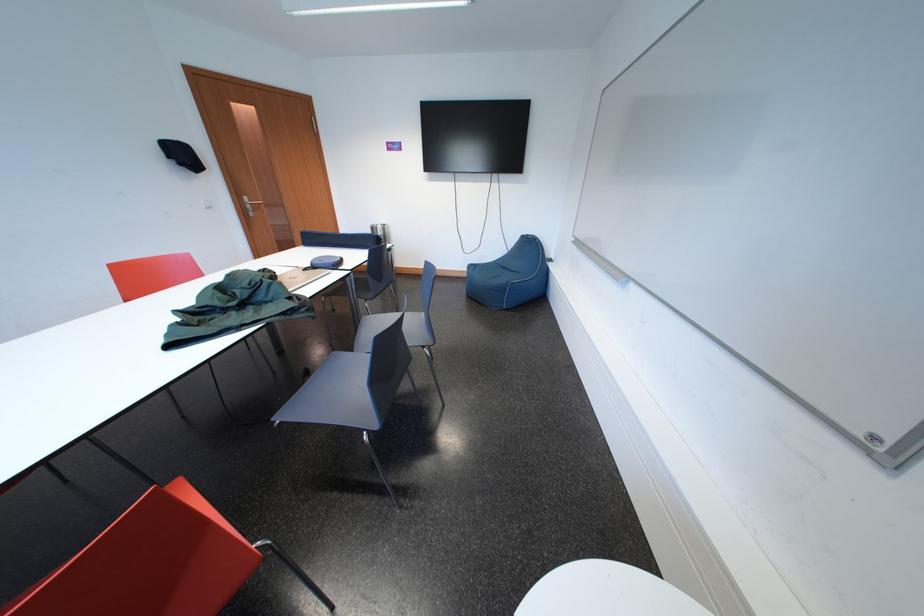
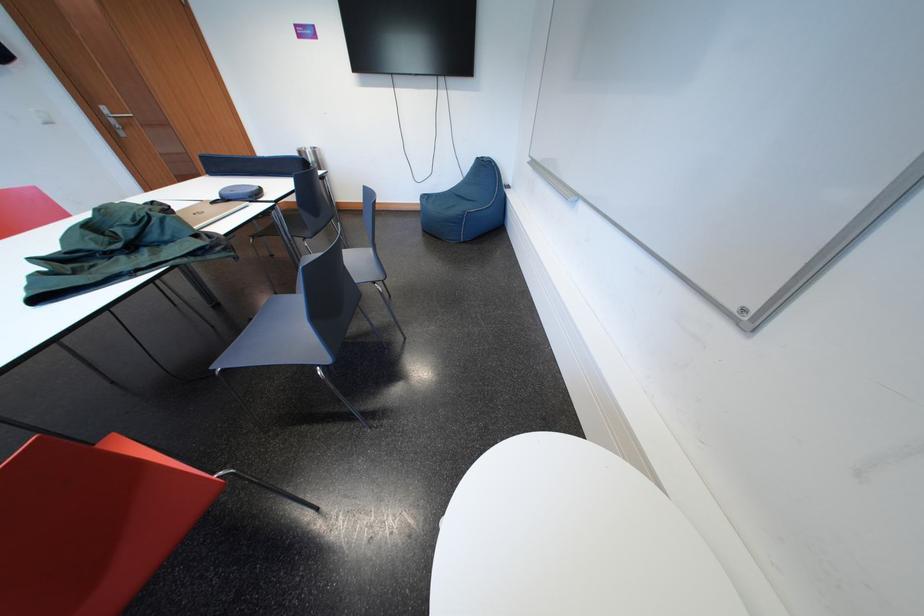
Where in the second image is the point corresponding to [423,330] from the first image?

(369, 264)